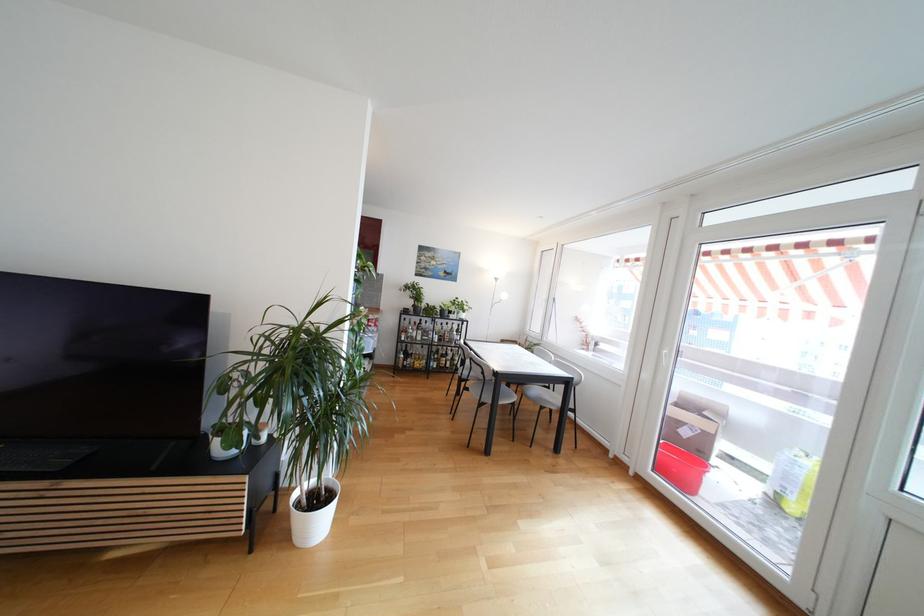
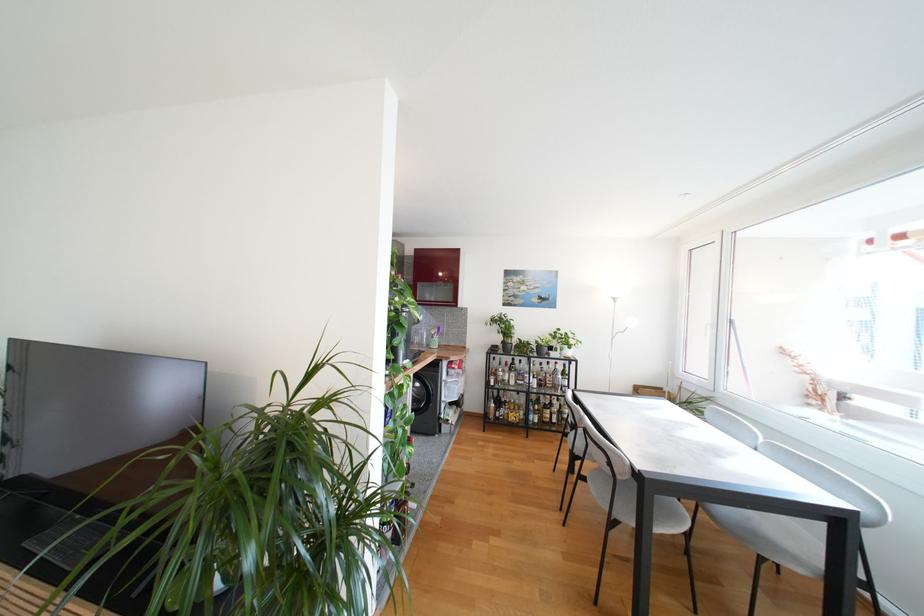
Find the pixel in the second image that matches the point at 408,326 in the first image.

(497, 366)